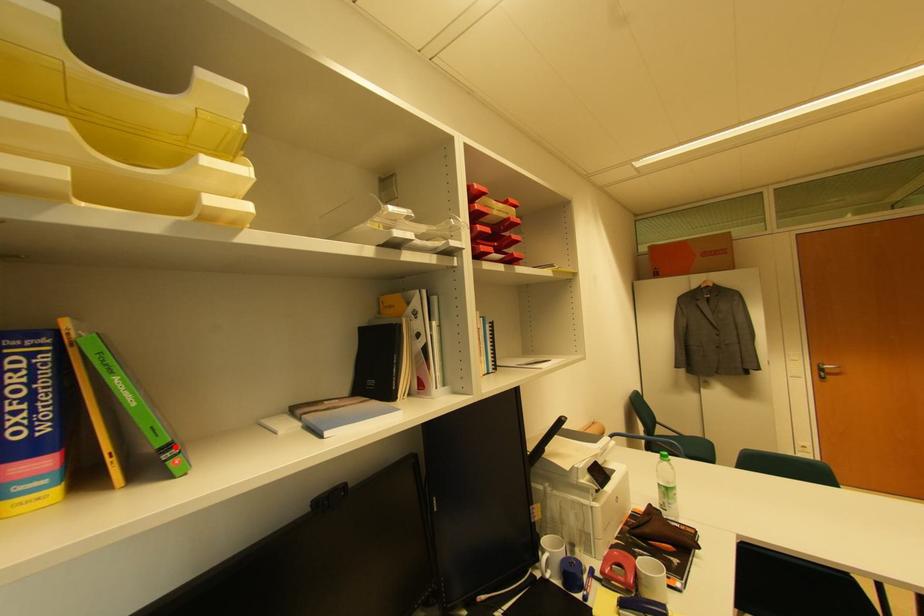
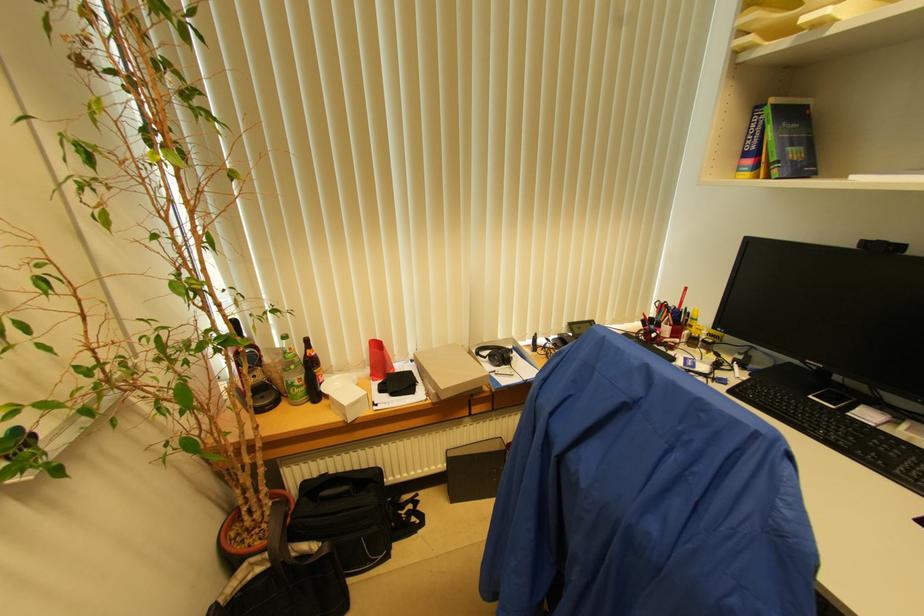
Where in the second image is the point corresponding to the highlighted location from the first image?

(780, 166)